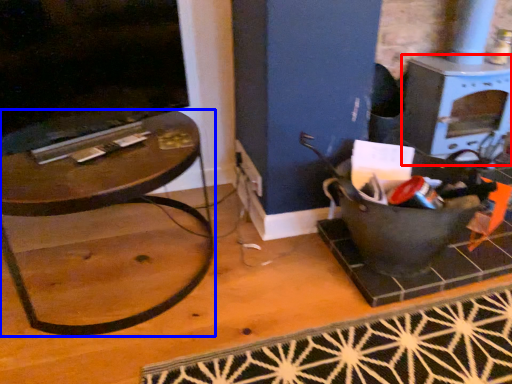
Question: Which object appears closest to the camera in this image, stove (highlighted by a red box) or table (highlighted by a blue box)?

Choices:
 (A) stove
 (B) table

Answer: (B)